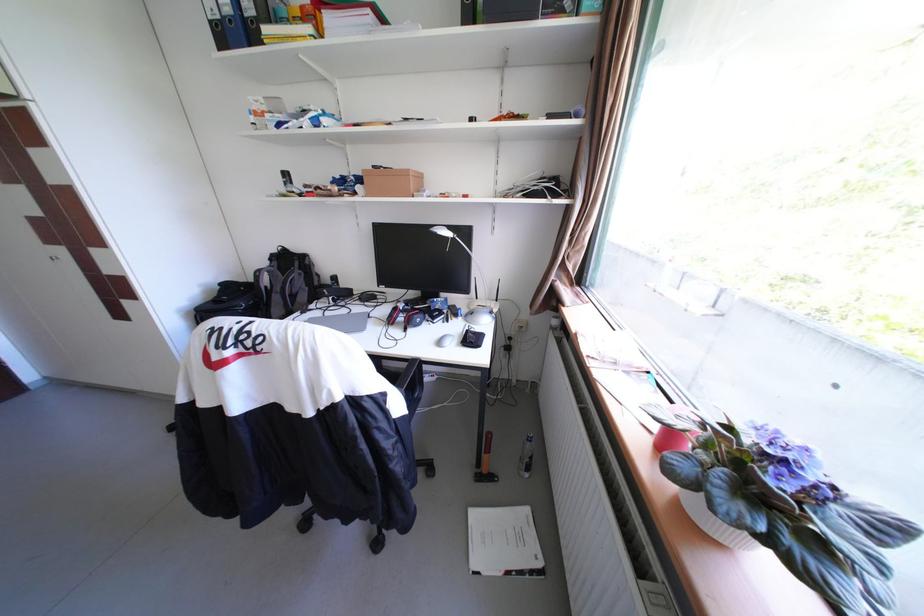
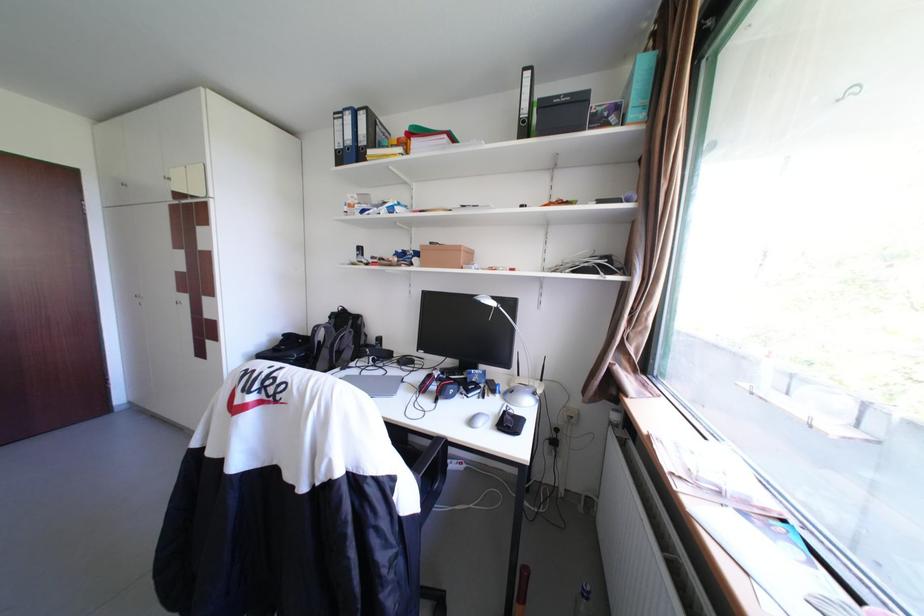
In the second image, find the point that corresponds to [374,172] in the first image.

(432, 246)